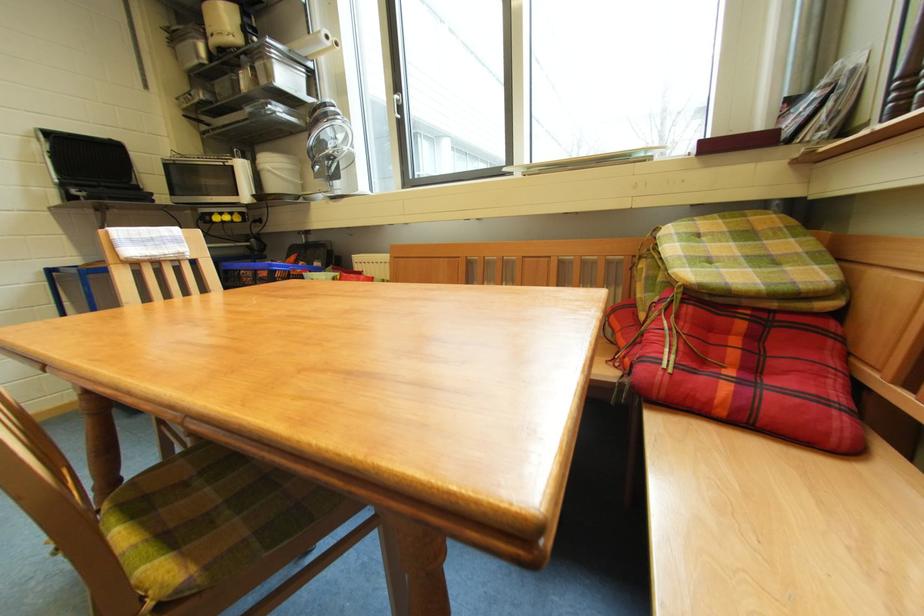
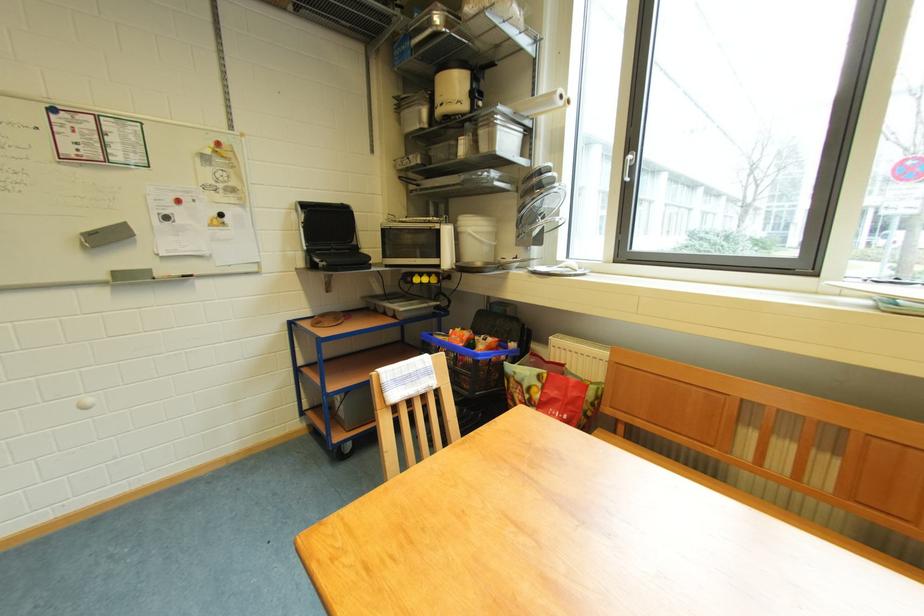
Locate, in the second image, the point that corresponds to point 281,171 in the first image.

(481, 235)